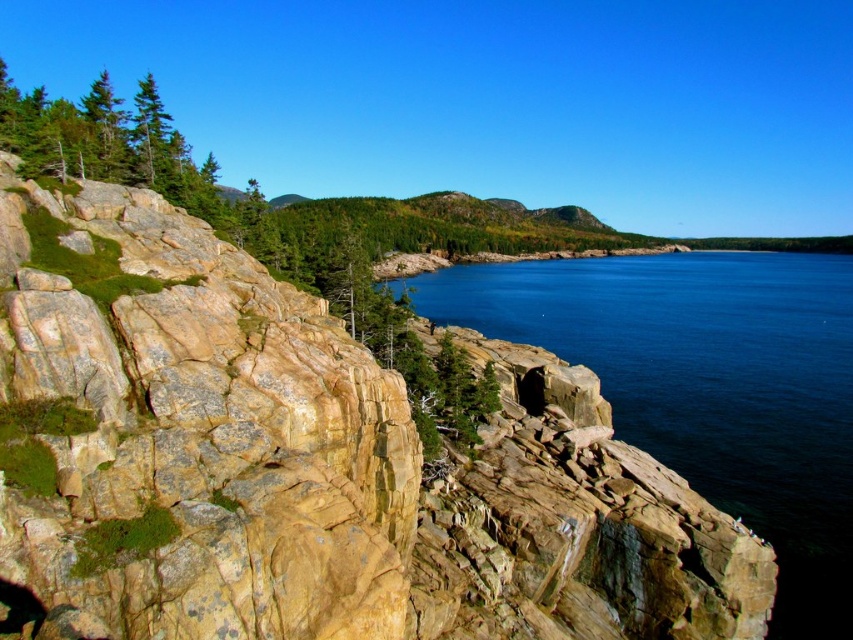
Looking at this image, you are a hiker standing at the base of the cliffs looking towards the water. You notice the yellowish rock at left and the blue smooth water at center. Which object appears larger in the scene?

The blue smooth water at center appears larger because the yellowish rock at left is smaller than it.

You are a hiker standing at the base of the cliffs. You see the yellowish rock at left and the blue smooth water at center. Which object is nearer to you?

The yellowish rock at left is closer to the viewer than the blue smooth water at center.